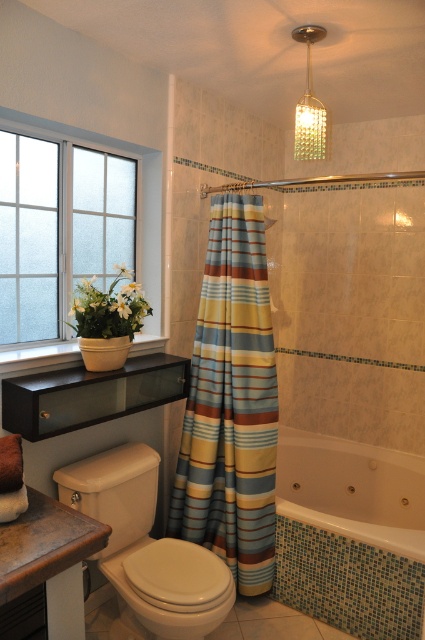
Question: Among these objects, which one is farthest from the camera?

Choices:
 (A) white glossy bathtub at lower right
 (B) white glossy toilet bowl at lower left
 (C) striped fabric shower curtain at center
 (D) beige ceramic toilet at lower left

Answer: (A)

Question: Which object is closer to the camera taking this photo?

Choices:
 (A) striped fabric shower curtain at center
 (B) white glossy toilet bowl at lower left
 (C) frosted glass window at left

Answer: (B)

Question: Which is farther from the white glossy bathtub at lower right?

Choices:
 (A) clear glass shower at upper center
 (B) brown leather vanity at lower left

Answer: (B)

Question: Where is frosted glass window at left located in relation to beige ceramic toilet at lower left in the image?

Choices:
 (A) right
 (B) left

Answer: (B)

Question: Does striped fabric shower curtain at center come in front of white glossy bathtub at lower right?

Choices:
 (A) no
 (B) yes

Answer: (B)

Question: Is frosted glass window at left to the left of white glossy toilet bowl at lower left from the viewer's perspective?

Choices:
 (A) yes
 (B) no

Answer: (A)